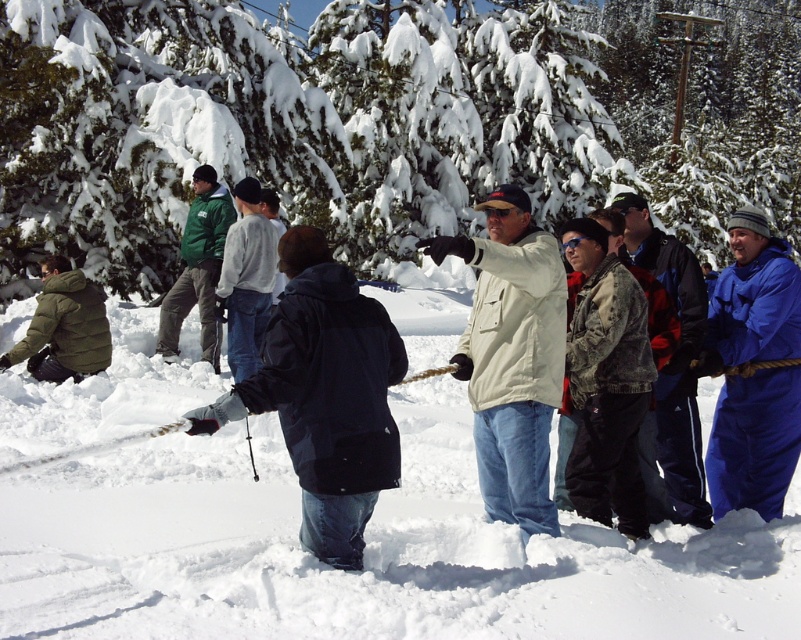
Question: Does dark blue jacket at center have a greater width compared to white plastic ski at center?

Choices:
 (A) no
 (B) yes

Answer: (A)

Question: Among these objects, which one is farthest from the camera?

Choices:
 (A) snow-covered evergreen tree at center
 (B) beige fabric jacket at center
 (C) white plastic ski at center

Answer: (A)

Question: Among these points, which one is farthest from the camera?

Choices:
 (A) (496, 406)
 (B) (717, 4)
 (C) (196, 252)
 (D) (372, 342)

Answer: (B)

Question: Among these objects, which one is farthest from the camera?

Choices:
 (A) white fluffy snow at center
 (B) white plastic ski at center
 (C) green fleece jacket at center

Answer: (C)

Question: Can you confirm if blue fleece jacket at right is wider than green down jacket at lower left?

Choices:
 (A) no
 (B) yes

Answer: (A)

Question: Can you confirm if dark blue jacket at center is wider than white plastic ski at center?

Choices:
 (A) no
 (B) yes

Answer: (A)